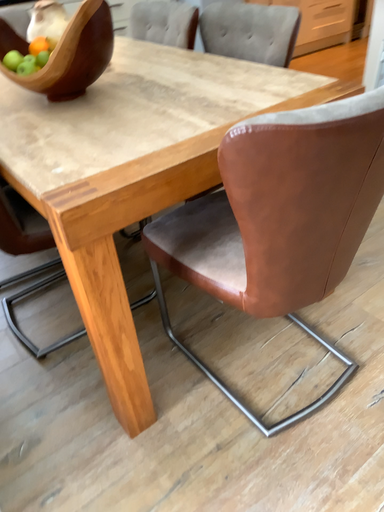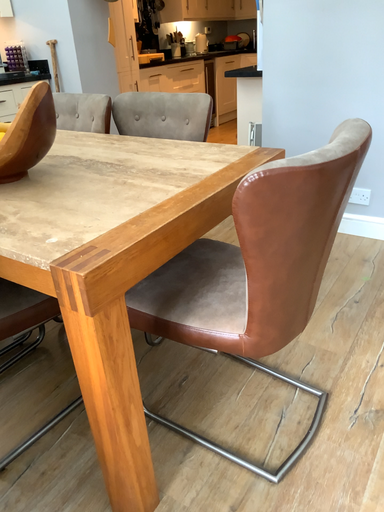
Question: How did the camera likely rotate when shooting the video?

Choices:
 (A) rotated downward
 (B) rotated upward

Answer: (B)